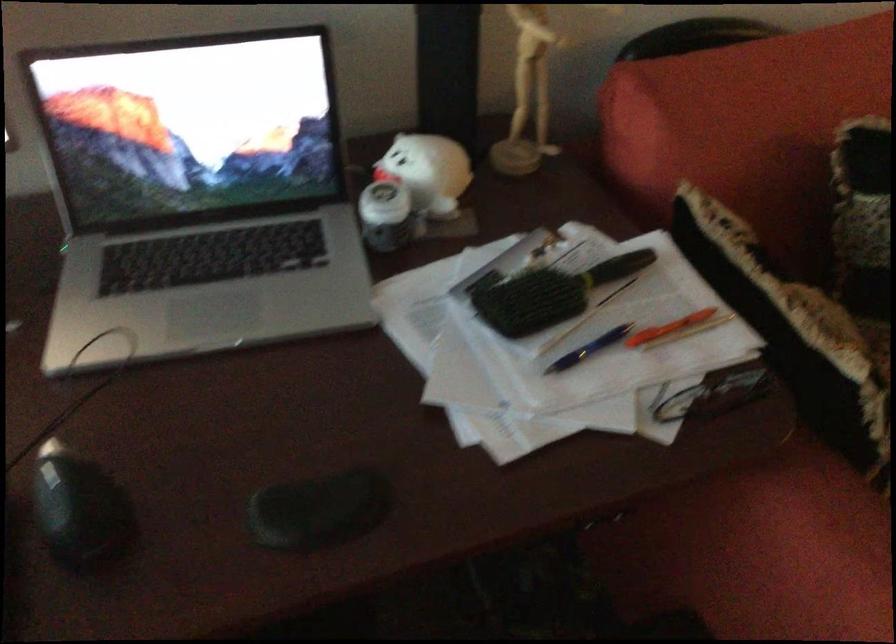
Locate an element on the screen. This screenshot has width=896, height=644. white ghost figurine is located at coordinates (428, 172).